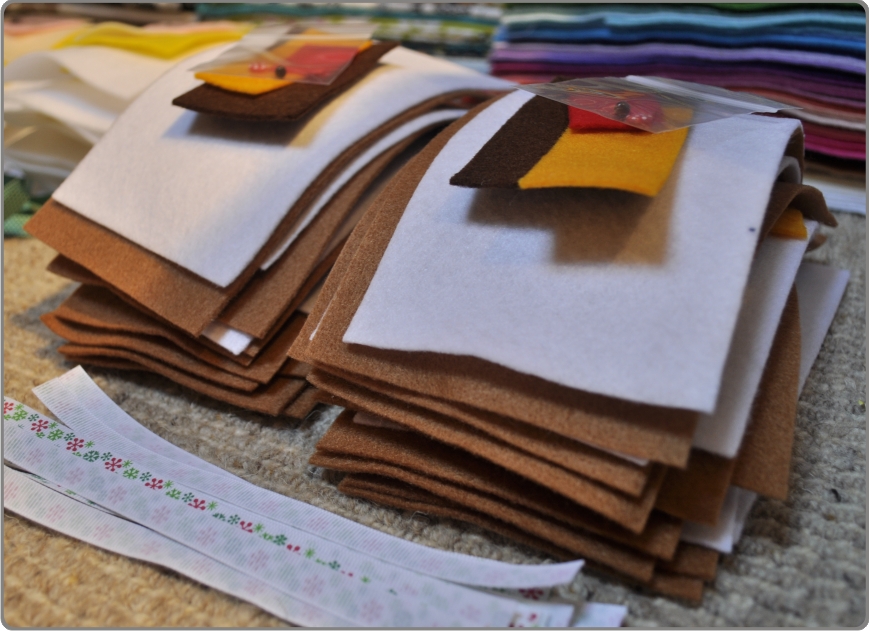
The image size is (869, 631). Find the location of `carpet`. carpet is located at coordinates (78, 599).